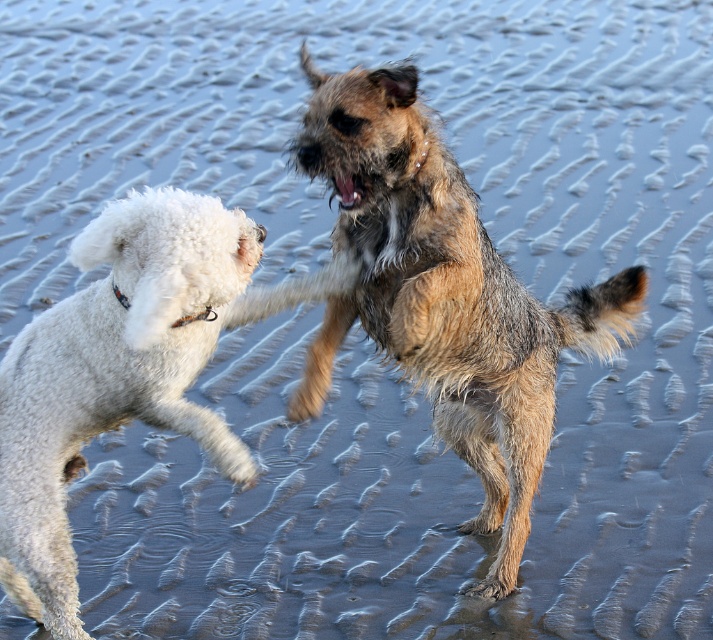
You are a dog owner trying to decide if you can safely separate two dogs playing on a beach. The dogs are the shaggy brown dog at center and the white fluffy dog at left. Based on their distance, can you easily reach both dogs with a 20 inch long toy to distract them?

The shaggy brown dog at center and the white fluffy dog at left are 19.85 inches apart, so yes, you can easily reach both dogs with a 20 inch long toy to distract them since the toy is slightly longer than the distance between them.

You are standing on the beach and see the shaggy brown dog at center. Can you estimate its position relative to the center of the beach?

The shaggy brown dog at center is located at point (443, 294), which is slightly to the right and below the exact center of the beach.

You are a dog trainer observing two dogs playing on a beach. You see the shaggy brown dog at center and the white fluffy dog at left. Based on their sizes, which dog would you recommend to keep a closer watch on to ensure safe play?

The shaggy brown dog at center is larger than the white fluffy dog at left, so it may require closer monitoring to ensure its play remains gentle and safe for both dogs.